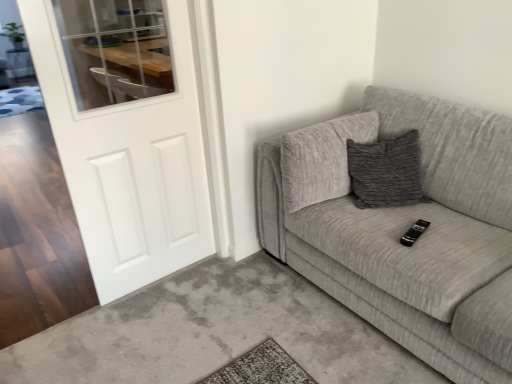
Question: Is textured gray couch at right inside the boundaries of black plastic remote at center, or outside?

Choices:
 (A) inside
 (B) outside

Answer: (B)

Question: Relative to black plastic remote at center, is textured gray couch at right in front or behind?

Choices:
 (A) front
 (B) behind

Answer: (A)

Question: Considering the real-world distances, which object is farthest from the white matte door at left?

Choices:
 (A) textured gray couch at right
 (B) black plastic remote at center

Answer: (B)

Question: Estimate the real-world distances between objects in this image. Which object is farther from the textured gray couch at right?

Choices:
 (A) white matte door at left
 (B) black plastic remote at center

Answer: (A)